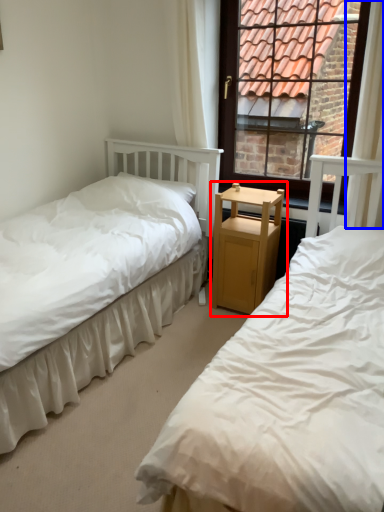
Question: Which of the following is the farthest to the observer, nightstand (highlighted by a red box) or curtain (highlighted by a blue box)?

Choices:
 (A) nightstand
 (B) curtain

Answer: (A)